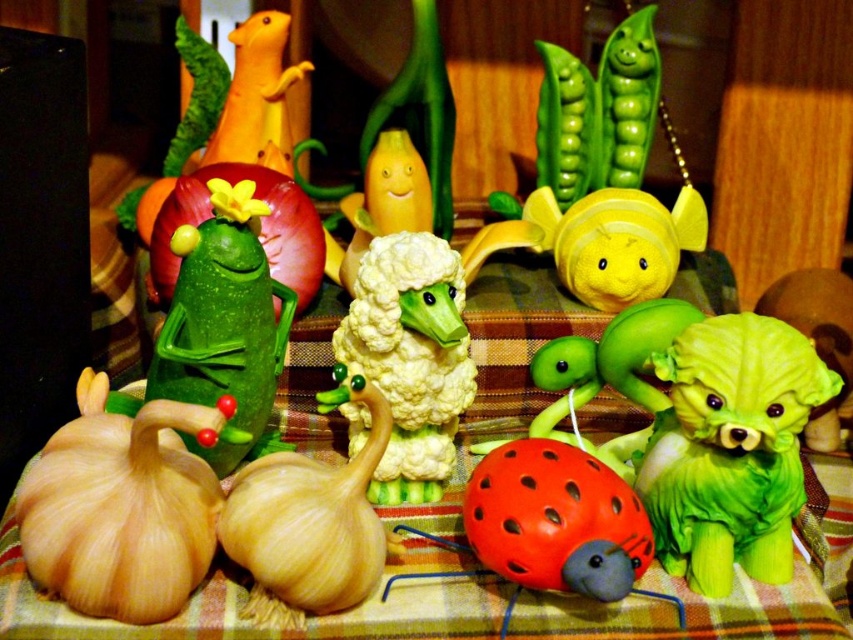
What is the position of the point labeled as point (x=550, y=525) in the image?

The point labeled as point (x=550, y=525) is on the rubber ladybug at center.

You are an interior designer arranging vegetables on a table. You need to place a new carrot figurine exactly 0.1 units to the right of the green matte cucumber at center. Where should you place it?

The green matte cucumber at center is located at point (224, 324). To place the carrot figurine 0.1 units to the right, move it to (224, 388).